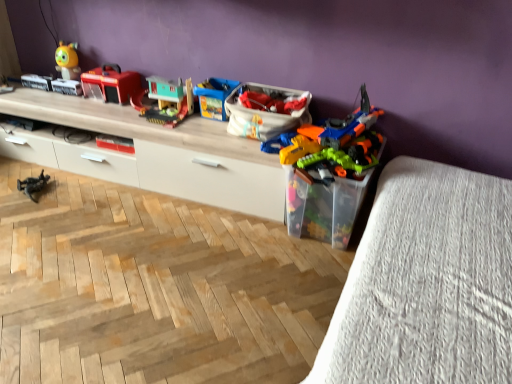
Question: Is wooden toy house at center, the 3th toy in the left-to-right sequence, looking in the opposite direction of metallic gray toy soldier at lower left, marked as the 1th toy in a left-to-right arrangement?

Choices:
 (A) no
 (B) yes

Answer: (A)

Question: Is wooden toy house at center, which is the 3th toy in right-to-left order, further to camera compared to metallic gray toy soldier at lower left, marked as the 1th toy in a left-to-right arrangement?

Choices:
 (A) no
 (B) yes

Answer: (A)

Question: Are wooden toy house at center, the 3th toy in the left-to-right sequence, and metallic gray toy soldier at lower left, the fifth toy in the right-to-left sequence, making contact?

Choices:
 (A) no
 (B) yes

Answer: (A)

Question: Is wooden toy house at center, which is the 3th toy in right-to-left order, not inside metallic gray toy soldier at lower left, marked as the 1th toy in a left-to-right arrangement?

Choices:
 (A) yes
 (B) no

Answer: (A)

Question: Can you confirm if wooden toy house at center, which is the 3th toy in right-to-left order, is shorter than metallic gray toy soldier at lower left, marked as the 1th toy in a left-to-right arrangement?

Choices:
 (A) no
 (B) yes

Answer: (A)

Question: Is wooden toy house at center, which is the 3th toy in right-to-left order, positioned before metallic gray toy soldier at lower left, marked as the 1th toy in a left-to-right arrangement?

Choices:
 (A) yes
 (B) no

Answer: (A)

Question: From the image's perspective, would you say translucent plastic storage box at center-right, which is the 2th storage box from top to bottom, is shown under translucent plastic toy container at lower right?

Choices:
 (A) yes
 (B) no

Answer: (B)

Question: Considering the relative sizes of translucent plastic storage box at center-right, acting as the 1th storage box starting from the bottom, and translucent plastic toy container at lower right in the image provided, is translucent plastic storage box at center-right, acting as the 1th storage box starting from the bottom, bigger than translucent plastic toy container at lower right?

Choices:
 (A) yes
 (B) no

Answer: (B)

Question: Is translucent plastic storage box at center-right, which is the 2th storage box from top to bottom, oriented away from translucent plastic toy container at lower right?

Choices:
 (A) yes
 (B) no

Answer: (B)

Question: Is translucent plastic storage box at center-right, acting as the 1th storage box starting from the bottom, facing towards translucent plastic toy container at lower right?

Choices:
 (A) yes
 (B) no

Answer: (B)

Question: Does translucent plastic storage box at center-right, which is the 2th storage box from top to bottom, appear on the left side of translucent plastic toy container at lower right?

Choices:
 (A) yes
 (B) no

Answer: (A)

Question: Is translucent plastic toy container at lower right a part of translucent plastic storage box at center-right, acting as the 1th storage box starting from the bottom?

Choices:
 (A) no
 (B) yes

Answer: (A)

Question: Is wooden toy house at center, which is the 3th toy in right-to-left order, looking in the opposite direction of blue plastic toy at center, which is the fourth toy from left to right?

Choices:
 (A) no
 (B) yes

Answer: (A)